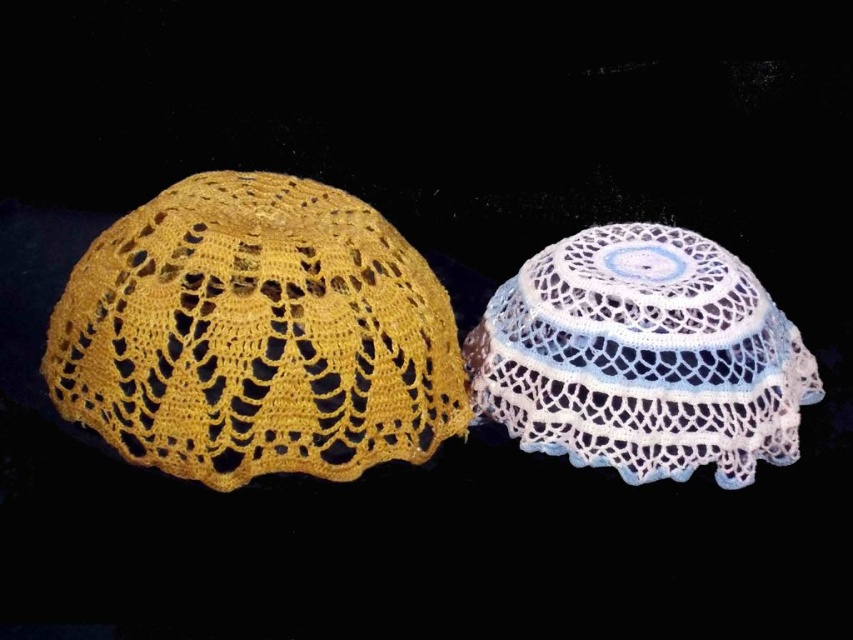
You are a fashion designer observing two crocheted items. You see a yellow crochet bonnet at left and a white crochet doily with light blue center at right. Which item is represented by the point located at coordinates (x=256, y=336)?

The yellow crochet bonnet at left is represented by the point located at coordinates (x=256, y=336).

You are organizing a craft fair and have two items to display. You have a yellow crochet bonnet at left and a white crochet doily at center. Which item requires a larger display space due to its size?

The yellow crochet bonnet at left requires a larger display space because it is larger in size than the white crochet doily at center.

You are a tailor who needs to decide which item to use for a headpiece. Given that the yellow crochet bonnet at left is taller than the white crochet doily at center, which one would be more suitable for a headpiece that requires height?

The yellow crochet bonnet at left is taller than the white crochet doily at center, making it more suitable for a headpiece that requires height.